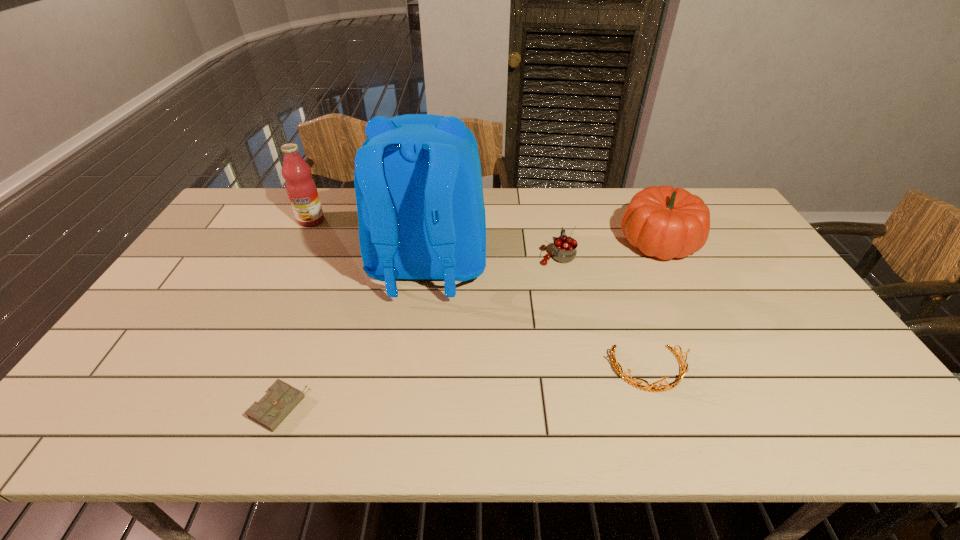
At what (x,y) coordinates should I click in order to perform the action: click on the third object from left to right. Please return your answer as a coordinate pair (x, y). This screenshot has height=540, width=960. Looking at the image, I should click on (418, 183).

This screenshot has height=540, width=960. I want to click on the tallest object, so click(418, 183).

Where is `fruit juice`? This screenshot has height=540, width=960. fruit juice is located at coordinates (301, 188).

Where is `the leftmost object`? This screenshot has width=960, height=540. the leftmost object is located at coordinates (301, 188).

Locate an element on the screen. The width and height of the screenshot is (960, 540). pumpkin is located at coordinates (664, 222).

Find the location of a particular element. the fourth object from left to right is located at coordinates (564, 250).

Image resolution: width=960 pixels, height=540 pixels. Find the location of `the third shortest object`. the third shortest object is located at coordinates (564, 250).

Identify the location of the fifth tallest object. The width and height of the screenshot is (960, 540). (633, 382).

The image size is (960, 540). Find the location of `the second object from left to right`. the second object from left to right is located at coordinates (280, 400).

This screenshot has height=540, width=960. Find the location of `diary`. diary is located at coordinates (280, 400).